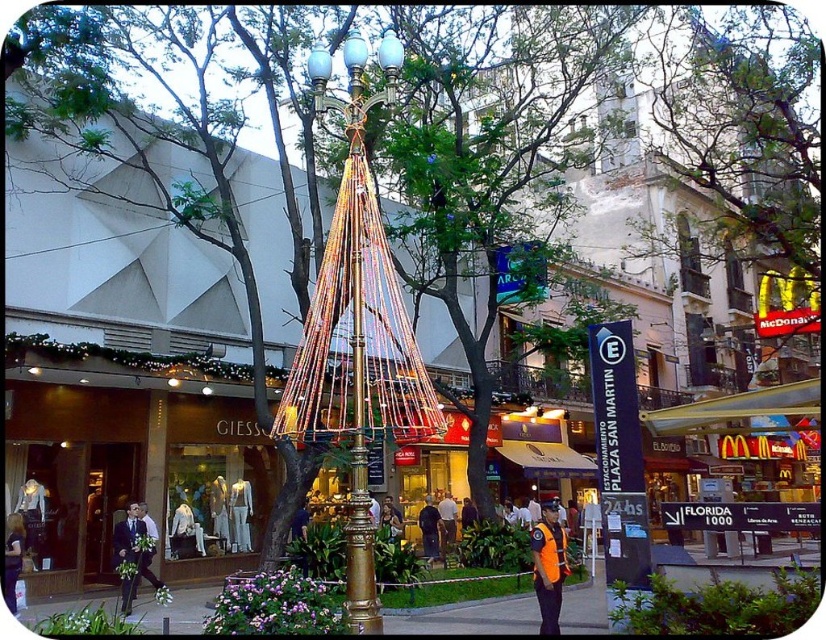
You are standing at the point with coordinates point (3, 554) and want to walk to the point with coordinates point (449, 525). Which direction should you move in?

You should move backward towards point (449, 525) because point (3, 554) is in front of it.

You are a window dresser preparing to arrange mannequins in the GIESS store window. You have a matte black suit at lower left and a dark blue shirt at center. Which item should you place higher to match the current display?

The matte black suit at lower left is taller than the dark blue shirt at center, so you should place the matte black suit at lower left higher to match the current display.